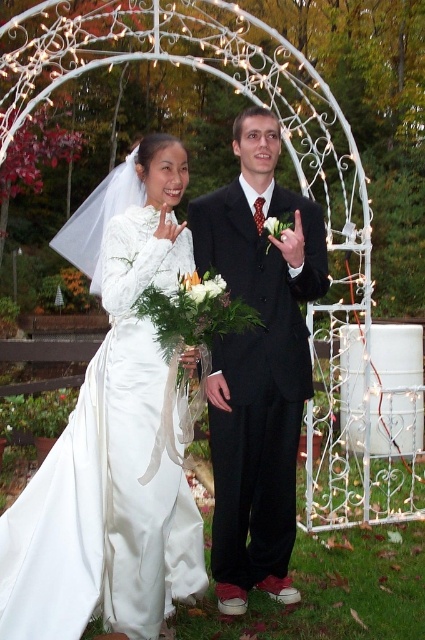
Question: Among these objects, which one is nearest to the camera?

Choices:
 (A) matte black suit at center
 (B) white satin dress at left

Answer: (B)

Question: Does white satin dress at left lie in front of matte black suit at center?

Choices:
 (A) yes
 (B) no

Answer: (A)

Question: Where is white satin dress at left located in relation to matte black suit at center in the image?

Choices:
 (A) above
 (B) below

Answer: (B)

Question: Does white satin dress at left have a lesser width compared to matte black suit at center?

Choices:
 (A) yes
 (B) no

Answer: (B)